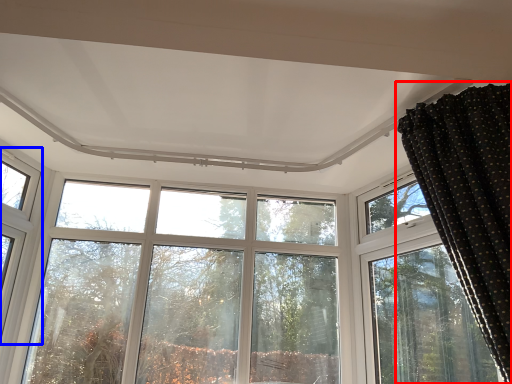
Question: Which of the following is the closest to the observer, curtain (highlighted by a red box) or window (highlighted by a blue box)?

Choices:
 (A) curtain
 (B) window

Answer: (A)